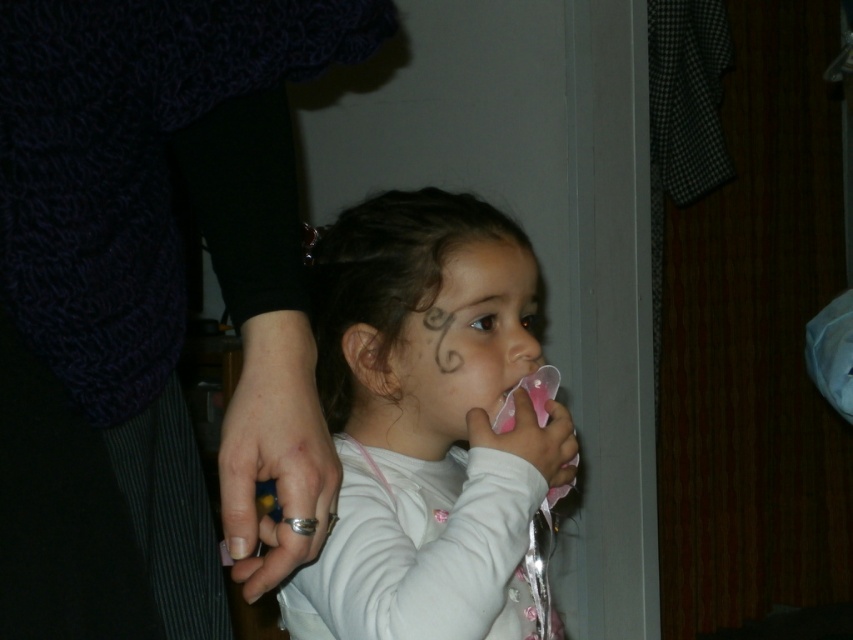
Question: Which object is closer to the camera taking this photo?

Choices:
 (A) knitted dark blue sweater at upper left
 (B) pink rubber pacifier at center
 (C) silver metallic teething ring at lower center

Answer: (A)

Question: Which point is closer to the camera taking this photo?

Choices:
 (A) (409, 362)
 (B) (39, 132)
 (C) (305, 534)
 (D) (419, 545)

Answer: (B)

Question: Can you confirm if knitted dark blue sweater at upper left is wider than matte white forehead at center?

Choices:
 (A) no
 (B) yes

Answer: (B)

Question: Is knitted dark blue sweater at upper left bigger than silver metallic teething ring at lower center?

Choices:
 (A) no
 (B) yes

Answer: (B)

Question: Which object appears closest to the camera in this image?

Choices:
 (A) white matte pacifier at center
 (B) knitted dark blue sweater at upper left
 (C) matte white forehead at center

Answer: (B)

Question: Does pink rubber pacifier at center lie behind matte white forehead at center?

Choices:
 (A) no
 (B) yes

Answer: (A)